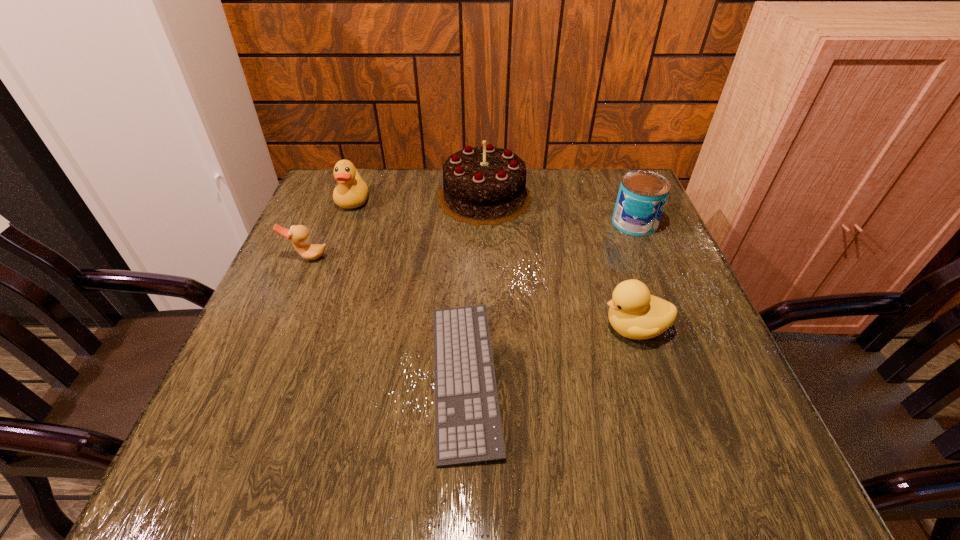
Identify the location of vacant space located on the front-facing side of the nearest duck. (486, 328).

The image size is (960, 540). What are the coordinates of `vacant point located on the front-facing side of the nearest duck` in the screenshot? It's located at (496, 328).

Locate an element on the screen. Image resolution: width=960 pixels, height=540 pixels. vacant space located on the front-facing side of the nearest duck is located at coordinates (506, 328).

Identify the location of vacant area situated on the beak of the second nearest duck. The width and height of the screenshot is (960, 540). (286, 309).

The height and width of the screenshot is (540, 960). What are the coordinates of `vacant area situated 0.330m on the right of the shortest object` in the screenshot? It's located at (684, 377).

Locate an element on the screen. birthday cake that is at the far edge is located at coordinates (486, 185).

What are the coordinates of `duck that is at the far edge` in the screenshot? It's located at (352, 191).

Find the location of `can positioned at the far edge`. can positioned at the far edge is located at coordinates (642, 196).

Locate an element on the screen. This screenshot has height=540, width=960. object at the near edge is located at coordinates (468, 426).

This screenshot has height=540, width=960. I want to click on can that is at the right edge, so click(642, 196).